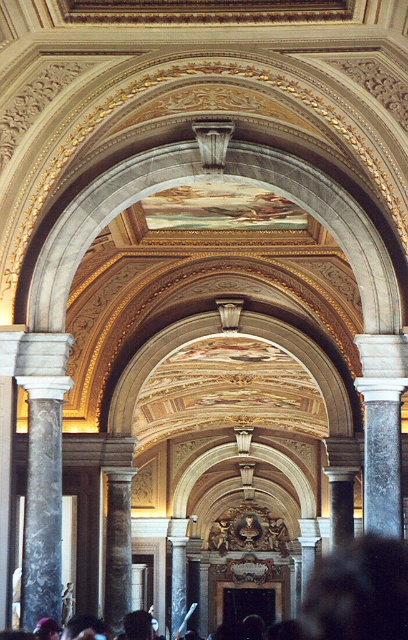
Question: Which point is farther to the camera?

Choices:
 (A) (30, 573)
 (B) (181, 593)

Answer: (B)

Question: Which is nearer to the marble column at left?

Choices:
 (A) dark hair at center
 (B) marble column at center

Answer: (A)

Question: Where is dark hair at center located in relation to marble column at center in the image?

Choices:
 (A) above
 (B) below

Answer: (A)

Question: Can you confirm if marble column at left is positioned to the right of marble column at center?

Choices:
 (A) no
 (B) yes

Answer: (A)

Question: Can you confirm if dark hair at center is positioned to the right of marble column at center?

Choices:
 (A) yes
 (B) no

Answer: (A)

Question: Among these objects, which one is farthest from the camera?

Choices:
 (A) marble column at center
 (B) marble column at left
 (C) dark hair at center

Answer: (A)